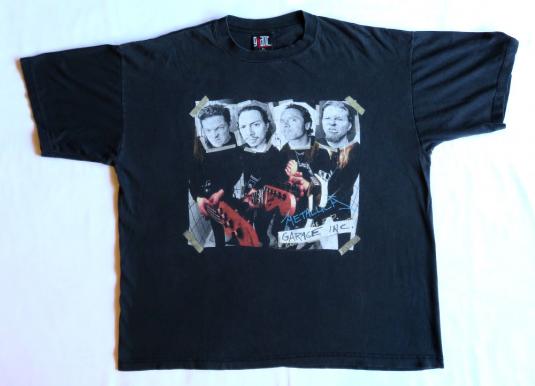
Where is `album`? The width and height of the screenshot is (535, 386). album is located at coordinates (328, 152).